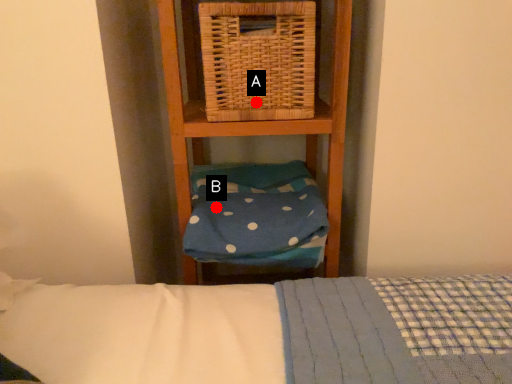
Question: Two points are circled on the image, labeled by A and B beside each circle. Which of the following is the farthest from the observer?

Choices:
 (A) A is further
 (B) B is further

Answer: (B)